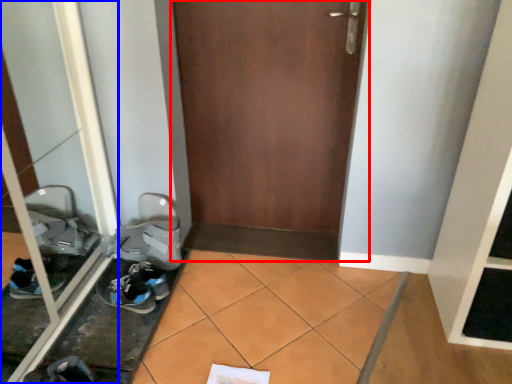
Question: Which object is further to the camera taking this photo, door (highlighted by a red box) or glass door (highlighted by a blue box)?

Choices:
 (A) door
 (B) glass door

Answer: (A)